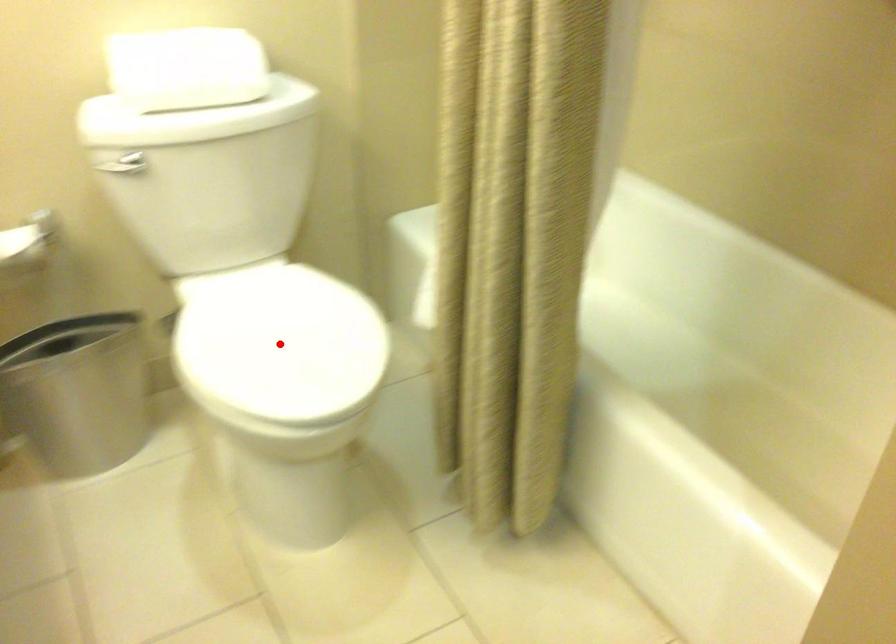
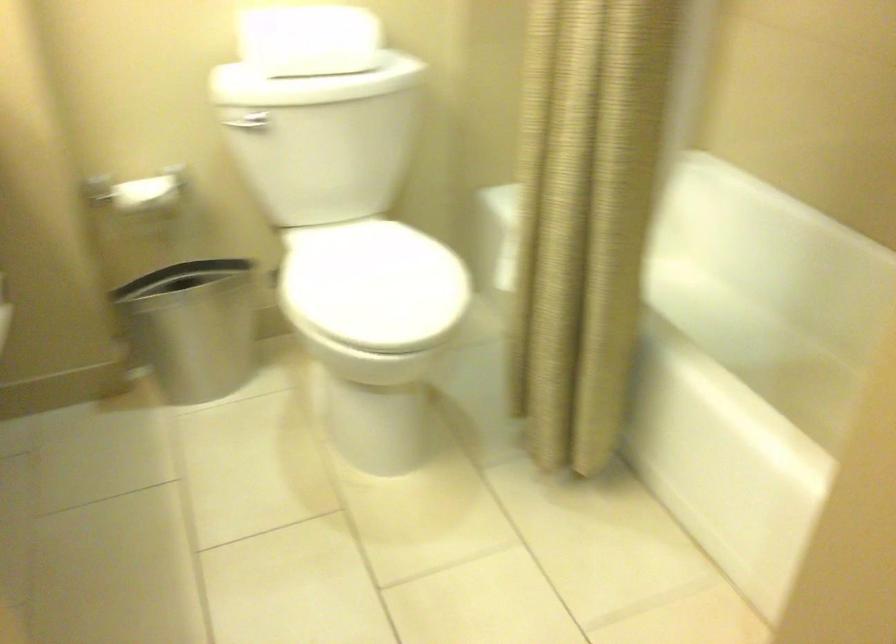
In the second image, find the point that corresponds to the highlighted location in the first image.

(372, 285)